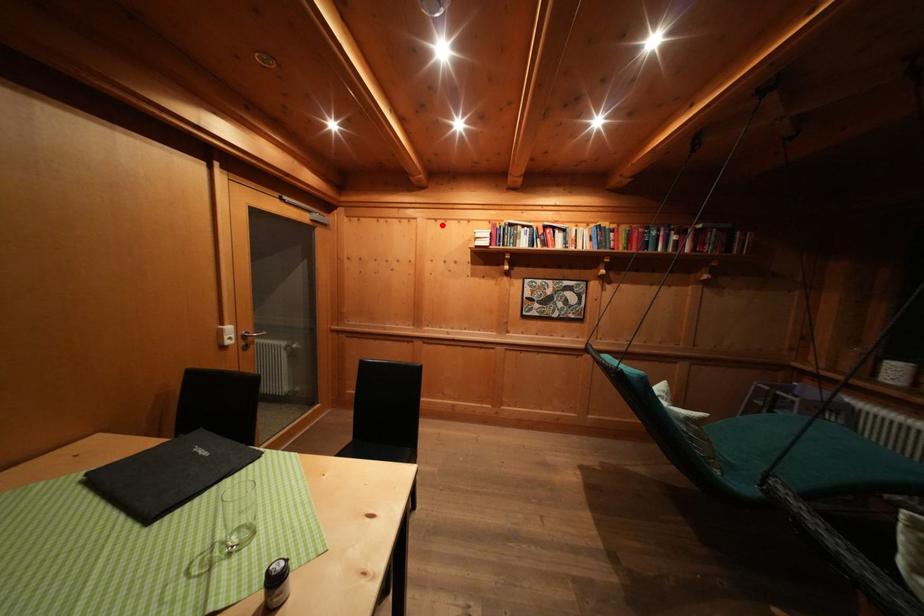
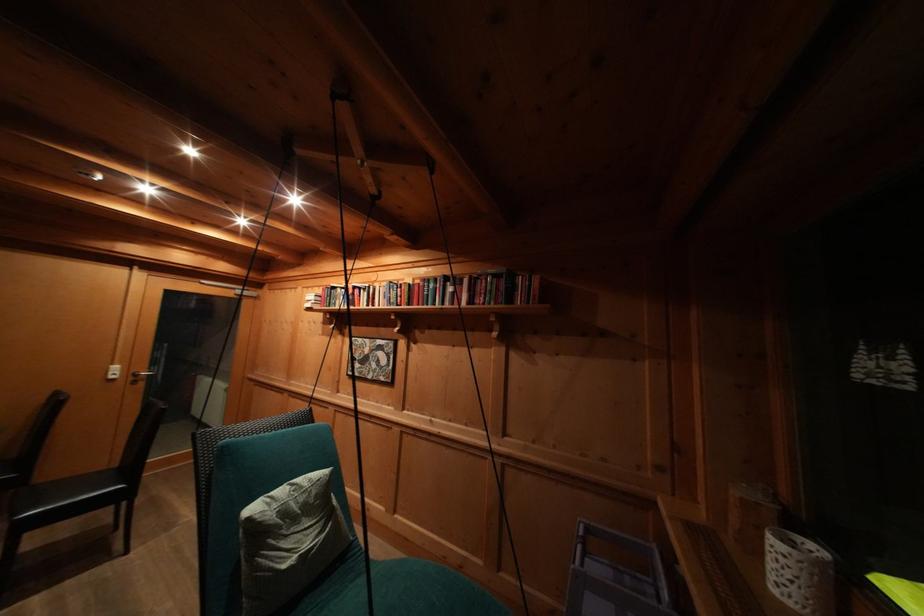
Where in the second image is the point corresponding to the highlighted location from the first image?

(313, 293)